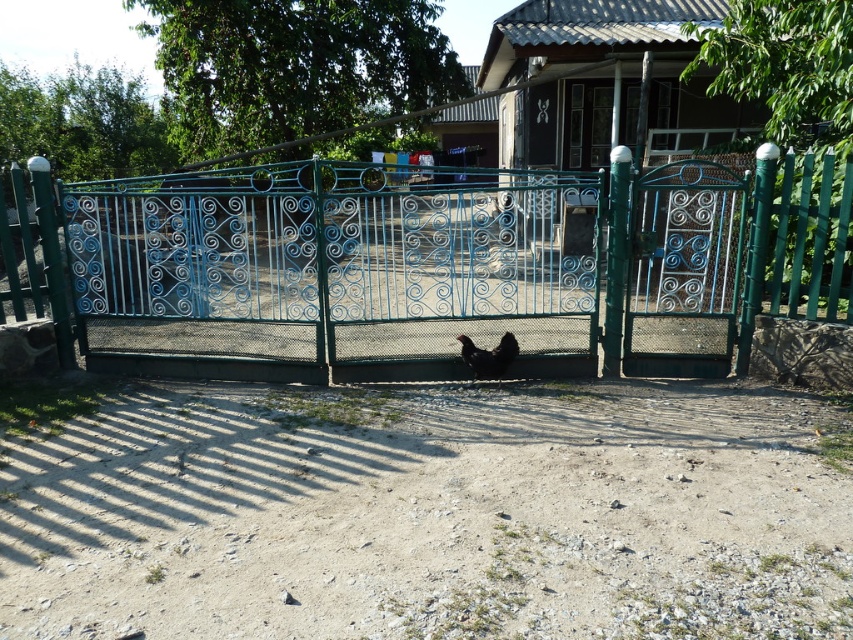
Question: Can you confirm if green wrought iron gate at center is positioned to the left of black matte chicken at center?

Choices:
 (A) yes
 (B) no

Answer: (B)

Question: Can you confirm if green wrought iron gate at center is positioned below black matte chicken at center?

Choices:
 (A) yes
 (B) no

Answer: (B)

Question: Among these points, which one is farthest from the camera?

Choices:
 (A) (463, 333)
 (B) (300, 369)

Answer: (A)

Question: Which point is closer to the camera?

Choices:
 (A) green wrought iron gate at center
 (B) black matte chicken at center

Answer: (A)

Question: Can you confirm if green wrought iron gate at center is smaller than black matte chicken at center?

Choices:
 (A) no
 (B) yes

Answer: (B)